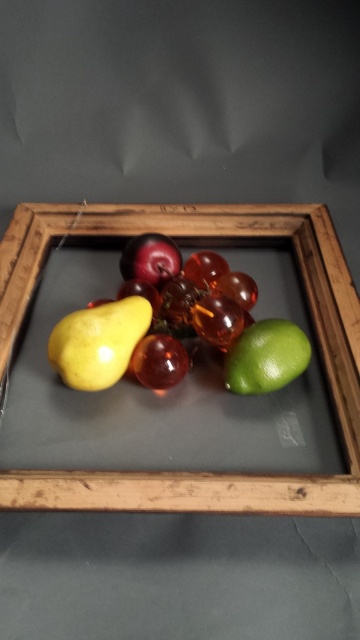
You are arranging fruits on a matte glass tray at center and a shiny red apple at center. Which object has a bigger surface area?

The matte glass tray at center has a larger size compared to the shiny red apple at center, so the matte glass tray at center has a bigger surface area.

You are arranging fruits in a display and want to ensure proper spacing between the green matte lime at lower right and the shiny red apple at center. Based on their sizes, which fruit requires more space horizontally?

The green matte lime at lower right requires more horizontal space because its width is larger than the shiny red apple at center.